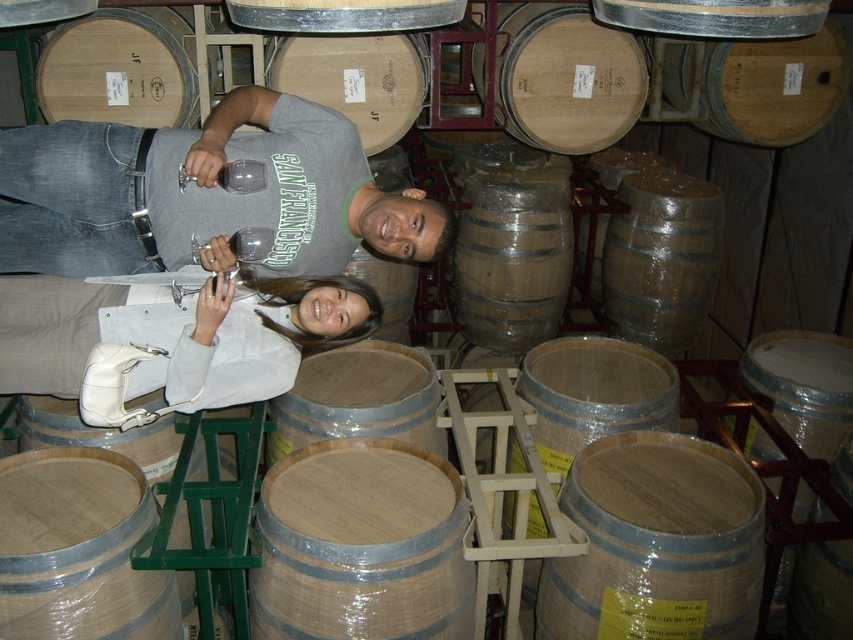
Question: Does matte gray t-shirt at center have a greater width compared to white leather purse at lower center?

Choices:
 (A) no
 (B) yes

Answer: (B)

Question: Which point is closer to the camera?

Choices:
 (A) white leather purse at lower center
 (B) matte gray t-shirt at center

Answer: (A)

Question: Which object is closer to the camera taking this photo?

Choices:
 (A) white leather purse at lower center
 (B) matte gray t-shirt at center

Answer: (A)

Question: Does matte gray t-shirt at center have a lesser width compared to white leather purse at lower center?

Choices:
 (A) no
 (B) yes

Answer: (A)

Question: Which of the following is the farthest from the observer?

Choices:
 (A) (270, 163)
 (B) (352, 333)

Answer: (B)

Question: Observing the image, what is the correct spatial positioning of matte gray t-shirt at center in reference to white leather purse at lower center?

Choices:
 (A) below
 (B) above

Answer: (B)